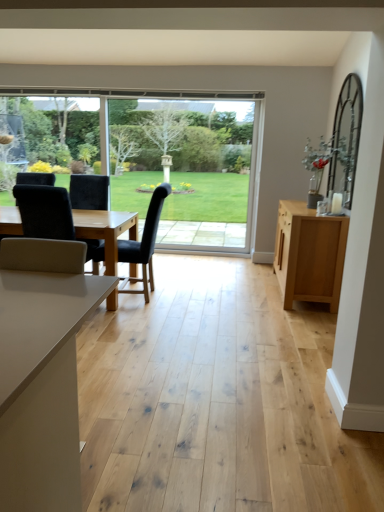
The image size is (384, 512). What do you see at coordinates (45, 212) in the screenshot?
I see `velvet black chair at left, which appears as the 1th chair when viewed from the left` at bounding box center [45, 212].

What do you see at coordinates (162, 158) in the screenshot? The image size is (384, 512). I see `clear glass window at center` at bounding box center [162, 158].

Describe the element at coordinates (144, 244) in the screenshot. I see `black fabric chair at center, the 1th chair when ordered from right to left` at that location.

This screenshot has height=512, width=384. What are the coordinates of `velvet black chair at left, the second chair in the right-to-left sequence` in the screenshot? It's located at (45, 212).

Is black fabric chair at center, arranged as the 2th chair when viewed from the left, not within clear glass window at center?

Indeed, black fabric chair at center, arranged as the 2th chair when viewed from the left, is completely outside clear glass window at center.

Is black fabric chair at center, the 1th chair when ordered from right to left, positioned with its back to clear glass window at center?

That's not correct — black fabric chair at center, the 1th chair when ordered from right to left, is not looking away from clear glass window at center.

Between black fabric chair at center, the 1th chair when ordered from right to left, and clear glass window at center, which one has more height?

With more height is clear glass window at center.

Which object is thinner, clear glass window at center or velvet black chair at left, the second chair in the right-to-left sequence?

clear glass window at center is thinner.

How many degrees apart are the facing directions of clear glass window at center and velvet black chair at left, which appears as the 1th chair when viewed from the left?

178 degrees separate the facing orientations of clear glass window at center and velvet black chair at left, which appears as the 1th chair when viewed from the left.

Considering the sizes of objects clear glass window at center and velvet black chair at left, the second chair in the right-to-left sequence, in the image provided, who is taller, clear glass window at center or velvet black chair at left, the second chair in the right-to-left sequence,?

clear glass window at center.

Is clear glass window at center spatially inside velvet black chair at left, the second chair in the right-to-left sequence, or outside of it?

clear glass window at center is spatially situated outside velvet black chair at left, the second chair in the right-to-left sequence.

Considering the relative positions of clear glass window at center and light wood cabinet at right in the image provided, is clear glass window at center behind light wood cabinet at right?

Yes, clear glass window at center is behind light wood cabinet at right.

How distant is clear glass window at center from light wood cabinet at right?

A distance of 2.12 meters exists between clear glass window at center and light wood cabinet at right.

From the image's perspective, would you say clear glass window at center is positioned over light wood cabinet at right?

Yes, from the image's perspective, clear glass window at center is above light wood cabinet at right.

This screenshot has width=384, height=512. Identify the location of window positioned vertically above the light wood cabinet at right (from a real-world perspective). (162, 158).

The image size is (384, 512). In the image, there is a black fabric chair at center, arranged as the 2th chair when viewed from the left. What are the coordinates of `window above it (from the image's perspective)` in the screenshot? It's located at (162, 158).

Is clear glass window at center positioned with its back to black fabric chair at center, the 1th chair when ordered from right to left?

clear glass window at center does not have its back to black fabric chair at center, the 1th chair when ordered from right to left.

Who is smaller, clear glass window at center or black fabric chair at center, arranged as the 2th chair when viewed from the left?

With smaller size is clear glass window at center.

Looking at this image, how different are the orientations of clear glass window at center and black fabric chair at center, arranged as the 2th chair when viewed from the left, in degrees?

88.1 degrees separate the facing orientations of clear glass window at center and black fabric chair at center, arranged as the 2th chair when viewed from the left.

Is velvet black chair at left, which appears as the 1th chair when viewed from the left, bigger or smaller than black fabric chair at center, the 1th chair when ordered from right to left?

velvet black chair at left, which appears as the 1th chair when viewed from the left, is smaller than black fabric chair at center, the 1th chair when ordered from right to left.

From the image's perspective, which is above, velvet black chair at left, the second chair in the right-to-left sequence, or black fabric chair at center, the 1th chair when ordered from right to left?

velvet black chair at left, the second chair in the right-to-left sequence.

Is velvet black chair at left, which appears as the 1th chair when viewed from the left, in front of or behind black fabric chair at center, arranged as the 2th chair when viewed from the left, in the image?

Visually, velvet black chair at left, which appears as the 1th chair when viewed from the left, is located in front of black fabric chair at center, arranged as the 2th chair when viewed from the left.

Is velvet black chair at left, which appears as the 1th chair when viewed from the left, facing towards black fabric chair at center, arranged as the 2th chair when viewed from the left?

No, velvet black chair at left, which appears as the 1th chair when viewed from the left, does not turn towards black fabric chair at center, arranged as the 2th chair when viewed from the left.

Could you measure the distance between black fabric chair at center, arranged as the 2th chair when viewed from the left, and light wood cabinet at right?

black fabric chair at center, arranged as the 2th chair when viewed from the left, and light wood cabinet at right are 1.45 meters apart.

Is black fabric chair at center, arranged as the 2th chair when viewed from the left, next to light wood cabinet at right?

black fabric chair at center, arranged as the 2th chair when viewed from the left, is not next to light wood cabinet at right, and they're not touching.

Consider the image. Is black fabric chair at center, the 1th chair when ordered from right to left, bigger than light wood cabinet at right?

Incorrect, black fabric chair at center, the 1th chair when ordered from right to left, is not larger than light wood cabinet at right.

Is light wood cabinet at right at the back of black fabric chair at center, arranged as the 2th chair when viewed from the left?

Yes, black fabric chair at center, arranged as the 2th chair when viewed from the left, is positioned with its back facing light wood cabinet at right.

Is black fabric chair at center, arranged as the 2th chair when viewed from the left, positioned with its back to velvet black chair at left, which appears as the 1th chair when viewed from the left?

No, black fabric chair at center, arranged as the 2th chair when viewed from the left,'s orientation is not away from velvet black chair at left, which appears as the 1th chair when viewed from the left.

Is black fabric chair at center, the 1th chair when ordered from right to left, thinner than velvet black chair at left, the second chair in the right-to-left sequence?

Yes.

Locate an element on the screen. window on the right side of black fabric chair at center, arranged as the 2th chair when viewed from the left is located at coordinates (162, 158).

Starting from the clear glass window at center, which chair is the 2nd one in front? Please provide its 2D coordinates.

[(45, 212)]

Which object lies further to the anchor point clear glass window at center, black fabric chair at center, arranged as the 2th chair when viewed from the left, or velvet black chair at left, which appears as the 1th chair when viewed from the left?

The object further to clear glass window at center is velvet black chair at left, which appears as the 1th chair when viewed from the left.

Which object lies nearer to the anchor point clear glass window at center, light wood cabinet at right or black fabric chair at center, arranged as the 2th chair when viewed from the left?

light wood cabinet at right lies closer to clear glass window at center than the other object.

Estimate the real-world distances between objects in this image. Which object is closer to light wood cabinet at right, black fabric chair at center, arranged as the 2th chair when viewed from the left, or velvet black chair at left, which appears as the 1th chair when viewed from the left?

black fabric chair at center, arranged as the 2th chair when viewed from the left, is positioned closer to the anchor light wood cabinet at right.

Based on their spatial positions, is black fabric chair at center, arranged as the 2th chair when viewed from the left, or light wood cabinet at right further from velvet black chair at left, the second chair in the right-to-left sequence?

Among the two, light wood cabinet at right is located further to velvet black chair at left, the second chair in the right-to-left sequence.

Looking at the image, which one is located further to black fabric chair at center, the 1th chair when ordered from right to left, velvet black chair at left, which appears as the 1th chair when viewed from the left, or light wood cabinet at right?

light wood cabinet at right.

Based on their spatial positions, is clear glass window at center or black fabric chair at center, the 1th chair when ordered from right to left, further from light wood cabinet at right?

clear glass window at center is positioned further to the anchor light wood cabinet at right.

Estimate the real-world distances between objects in this image. Which object is closer to clear glass window at center, velvet black chair at left, which appears as the 1th chair when viewed from the left, or light wood cabinet at right?

light wood cabinet at right is positioned closer to the anchor clear glass window at center.

Based on their spatial positions, is velvet black chair at left, the second chair in the right-to-left sequence, or black fabric chair at center, the 1th chair when ordered from right to left, further from clear glass window at center?

Based on the image, velvet black chair at left, the second chair in the right-to-left sequence, appears to be further to clear glass window at center.

Identify the location of window between velvet black chair at left, the second chair in the right-to-left sequence, and light wood cabinet at right. Image resolution: width=384 pixels, height=512 pixels. (162, 158).

You are a GUI agent. You are given a task and a screenshot of the screen. Output one action in this format:
    pyautogui.click(x=<x>, y=<y>)
    Task: Click on the chair between velvet black chair at left, the second chair in the right-to-left sequence, and clear glass window at center from front to back
    
    Given the screenshot: What is the action you would take?
    pyautogui.click(x=144, y=244)

Identify the location of chair located between light wood cabinet at right and clear glass window at center in the depth direction. The height and width of the screenshot is (512, 384). (144, 244).

The width and height of the screenshot is (384, 512). In order to click on chair between velvet black chair at left, which appears as the 1th chair when viewed from the left, and light wood cabinet at right in this screenshot , I will do `click(144, 244)`.